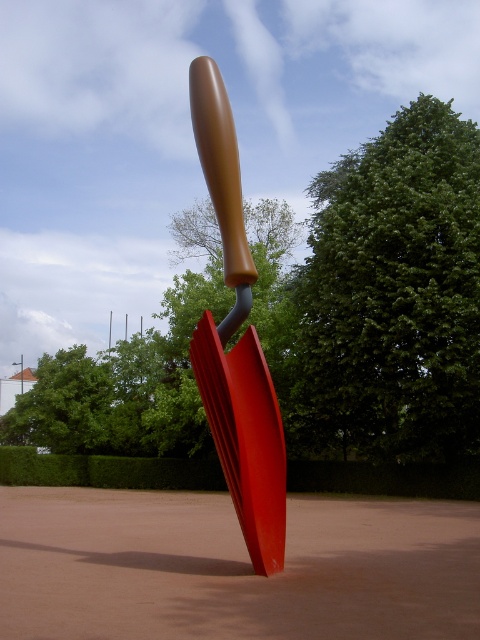
Question: Which object is farther from the camera taking this photo?

Choices:
 (A) green leafy tree at upper center
 (B) matte brown handle at center

Answer: (A)

Question: Which object is farther from the camera taking this photo?

Choices:
 (A) green leafy tree at upper center
 (B) matte brown handle at center

Answer: (A)

Question: Does green leafy tree at upper center have a larger size compared to matte brown handle at center?

Choices:
 (A) no
 (B) yes

Answer: (B)

Question: Is green leafy tree at upper center to the left of matte brown handle at center from the viewer's perspective?

Choices:
 (A) no
 (B) yes

Answer: (A)

Question: Can you confirm if green leafy tree at upper center is bigger than matte brown handle at center?

Choices:
 (A) no
 (B) yes

Answer: (B)